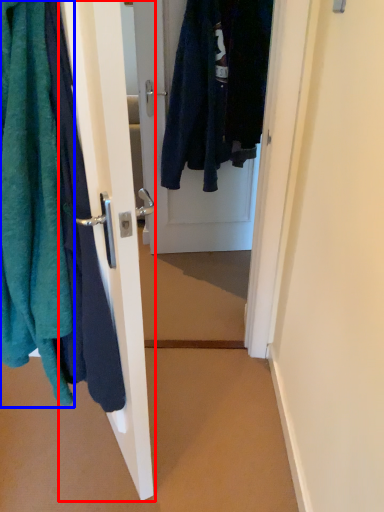
Question: Which object appears farthest to the camera in this image, door (highlighted by a red box) or towel (highlighted by a blue box)?

Choices:
 (A) door
 (B) towel

Answer: (A)